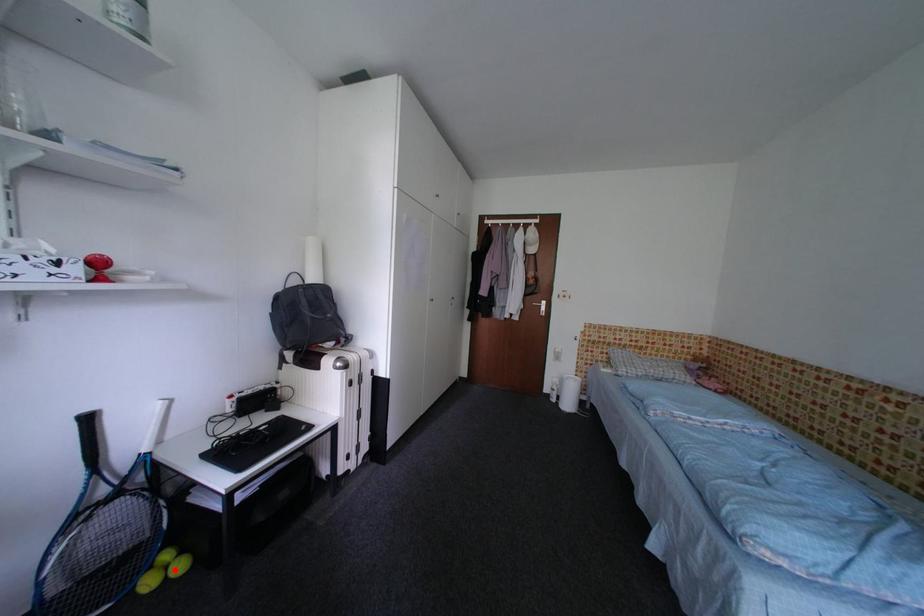
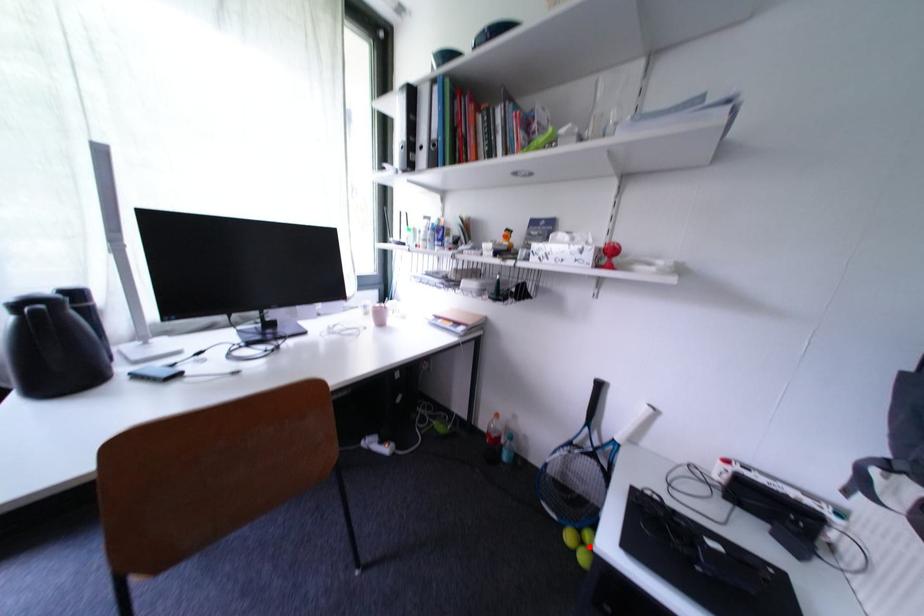
I am providing you with two images of the same scene from different viewpoints. A red point is marked on the first image and another point is marked on the second image. Are the points marked in image1 and image2 representing the same 3D position?

Yes